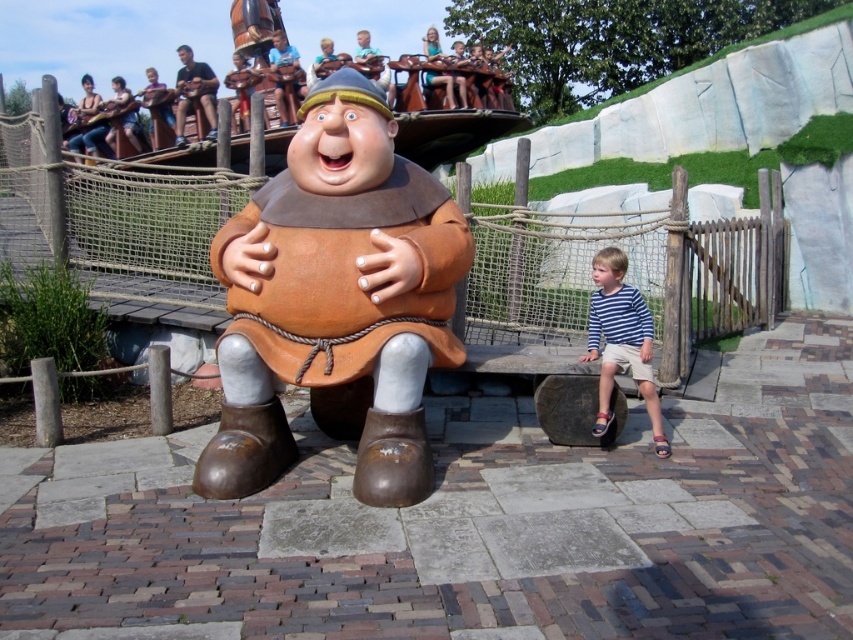
You are a visitor at the amusement park and you want to take a photo of the brown matte statue at center and the blue striped shirt at lower right. Where should you stand to capture both in the frame?

To capture both the brown matte statue at center and the blue striped shirt at lower right in the frame, you should stand at a position where you can see both objects. Since the brown matte statue at center is located above the blue striped shirt at lower right, positioning yourself in front of the statue but slightly lower might allow you to include both in your photo.

You are standing in front of the brown matte statue at center at an amusement park. If you want to take a photo of the entire statue in one frame, would you need to move closer or farther away?

The brown matte statue at center is 4.09 meters away from the viewer. To capture the entire statue in one frame, you would need to move farther away to ensure the statue fits within the camera view.